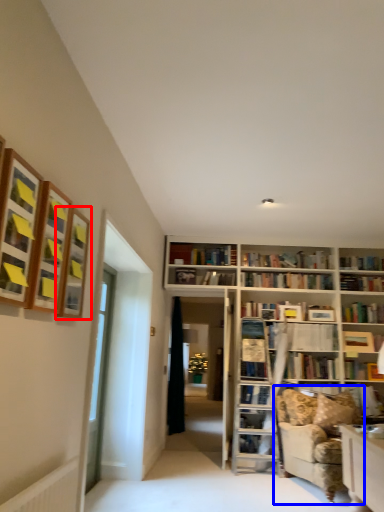
Question: Which object is closer to the camera taking this photo, shelf (highlighted by a red box) or studio couch (highlighted by a blue box)?

Choices:
 (A) shelf
 (B) studio couch

Answer: (A)